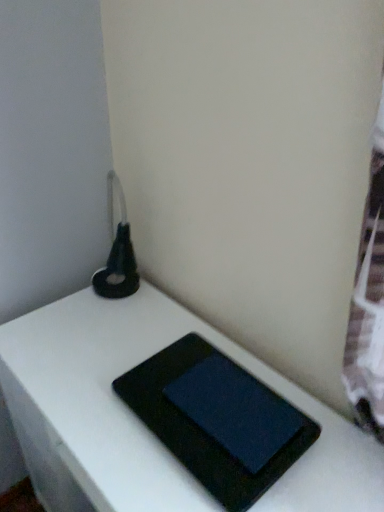
Locate an element on the screen. This screenshot has width=384, height=512. free location to the right of matte black tablet at center, acting as the 2th tablet computer starting from the bottom is located at coordinates (329, 439).